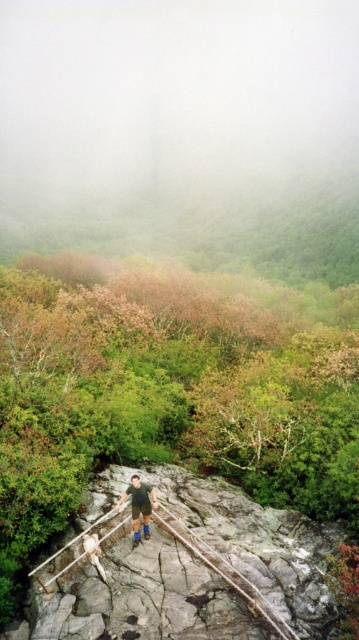
Can you confirm if rusty metal suspension bridge at center is bigger than blue denim shorts at center?

Indeed, rusty metal suspension bridge at center has a larger size compared to blue denim shorts at center.

From the picture: Does rusty metal suspension bridge at center have a smaller size compared to blue denim shorts at center?

Actually, rusty metal suspension bridge at center might be larger than blue denim shorts at center.

In order to click on rusty metal suspension bridge at center in this screenshot , I will do `click(174, 568)`.